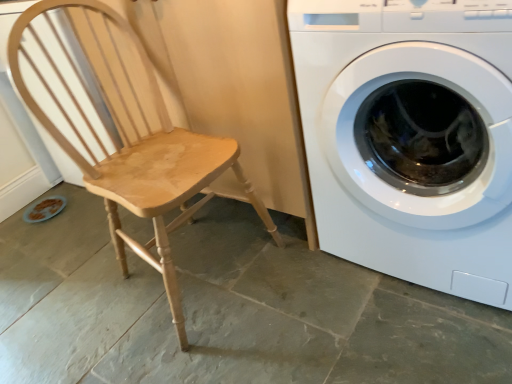
This screenshot has height=384, width=512. I want to click on free space in front of light wood chair at left, so (227, 354).